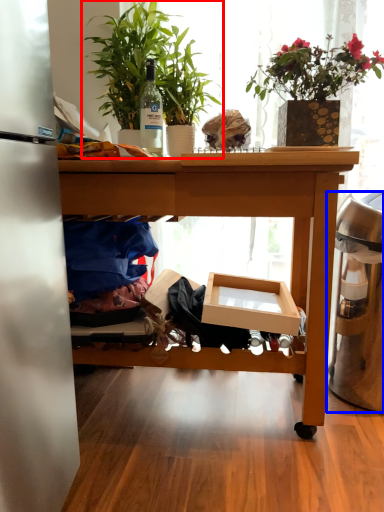
Question: Which point is further to the camera, houseplant (highlighted by a red box) or trash bin/can (highlighted by a blue box)?

Choices:
 (A) houseplant
 (B) trash bin/can

Answer: (B)